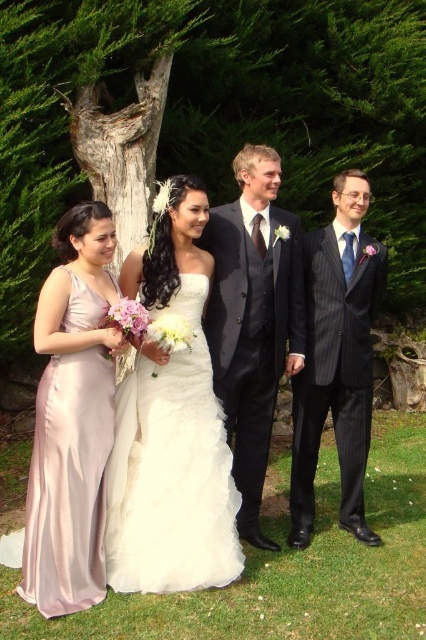
Question: Which object is positioned closest to the dark pinstripe suit at right?

Choices:
 (A) silky pink dress at left
 (B) rough bark tree at center

Answer: (A)

Question: Which point is closer to the camera?

Choices:
 (A) (400, 86)
 (B) (46, 616)
 (C) (307, 538)
 (D) (242, 337)

Answer: (B)

Question: Is the position of rough bark tree at center more distant than that of silky pink dress at left?

Choices:
 (A) no
 (B) yes

Answer: (B)

Question: Estimate the real-world distances between objects in this image. Which object is closer to the white satin dress at center?

Choices:
 (A) silky pink dress at left
 (B) dark pinstripe suit at right
 (C) dark gray suit at center
 (D) rough bark tree at center

Answer: (A)

Question: Is dark pinstripe suit at right below silky pink dress at left?

Choices:
 (A) yes
 (B) no

Answer: (B)

Question: Is white satin dress at center wider than silky pink dress at left?

Choices:
 (A) yes
 (B) no

Answer: (A)